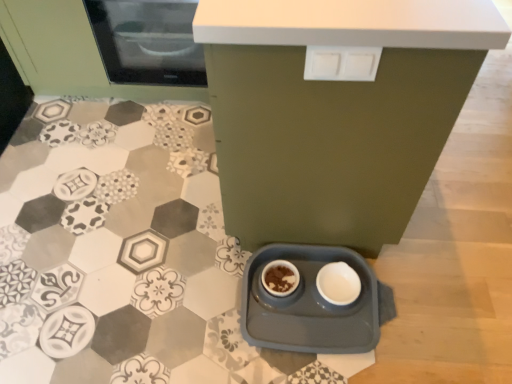
The width and height of the screenshot is (512, 384). Find the location of `space that is in front of white glossy bowl at lower center`. space that is in front of white glossy bowl at lower center is located at coordinates (335, 329).